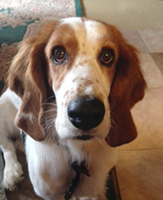
I want to click on border of the rug, so click(80, 1), click(80, 13), click(112, 184), click(114, 195).